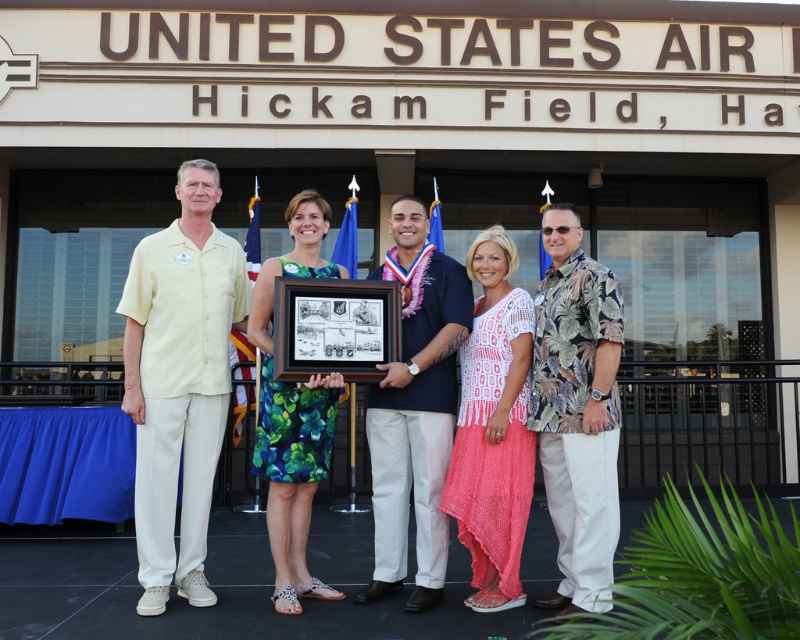
Question: Which object appears farthest from the camera in this image?

Choices:
 (A) yellow textured shirt at left
 (B) hawaiian print shirt at right

Answer: (A)

Question: Which point is farther from the camera taking this photo?

Choices:
 (A) (441, 266)
 (B) (442, 561)
 (C) (208, 256)
 (D) (560, 595)

Answer: (C)

Question: Is green floral dress at center below hawaiian print shirt at right?

Choices:
 (A) yes
 (B) no

Answer: (A)

Question: Where is yellow textured shirt at left located in relation to green floral dress at center in the image?

Choices:
 (A) right
 (B) left

Answer: (B)

Question: Which of the following is the farthest from the observer?

Choices:
 (A) (458, 300)
 (B) (220, 422)
 (C) (602, 424)
 (D) (252, 294)

Answer: (D)

Question: Can you confirm if green floral dress at center is smaller than dark blue shirt at center?

Choices:
 (A) yes
 (B) no

Answer: (B)